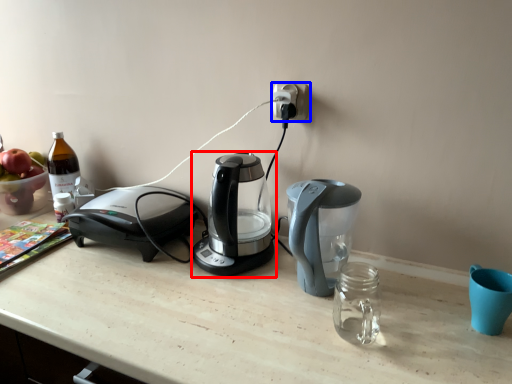
Question: Which object appears farthest to the camera in this image, coffee maker (highlighted by a red box) or power plugs and sockets (highlighted by a blue box)?

Choices:
 (A) coffee maker
 (B) power plugs and sockets

Answer: (B)